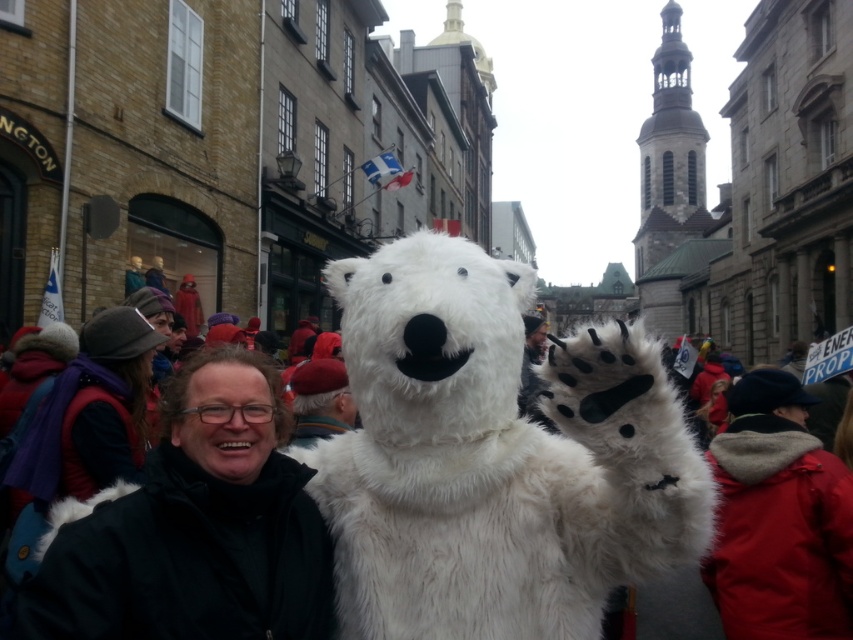
You are standing at the front of the crowd in a lively street scene. You see a person in a white polar bear costume and a man in a red fur coat at lower right. Which object is closer to you?

The person in the white polar bear costume is closer to you than the red fur coat at lower right, as the red fur coat at lower right is 37.03 meters away from the viewer.

You are a photographer standing in the crowd at the event. You want to take a closeup photo of the white furry teddy bear at center. Considering your camera can focus on subjects within 50 feet, will you be able to take the photo without moving closer?

The white furry teddy bear at center is 106.74 feet away from the viewer, which is beyond the camera focus range of 50 feet. Therefore, you cannot take a clear closeup photo without moving closer.